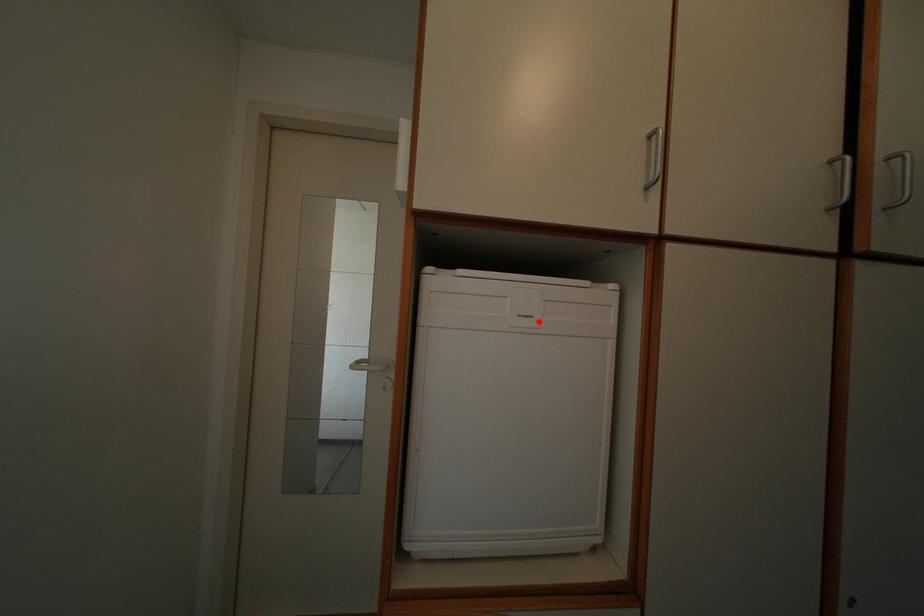
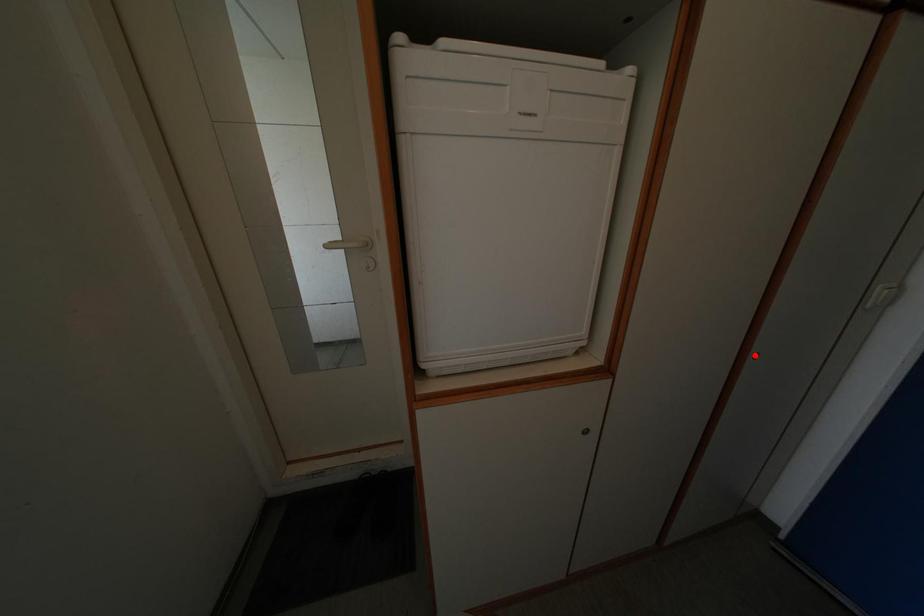
I am providing you with two images of the same scene from different viewpoints. A red point is marked on the first image and another point is marked on the second image. Is the red point in image1 aligned with the point shown in image2?

No